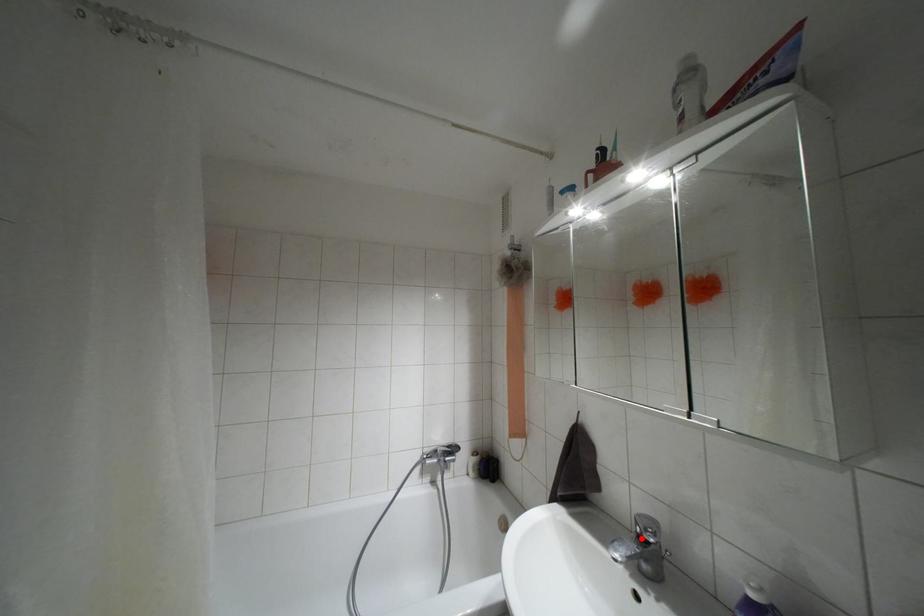
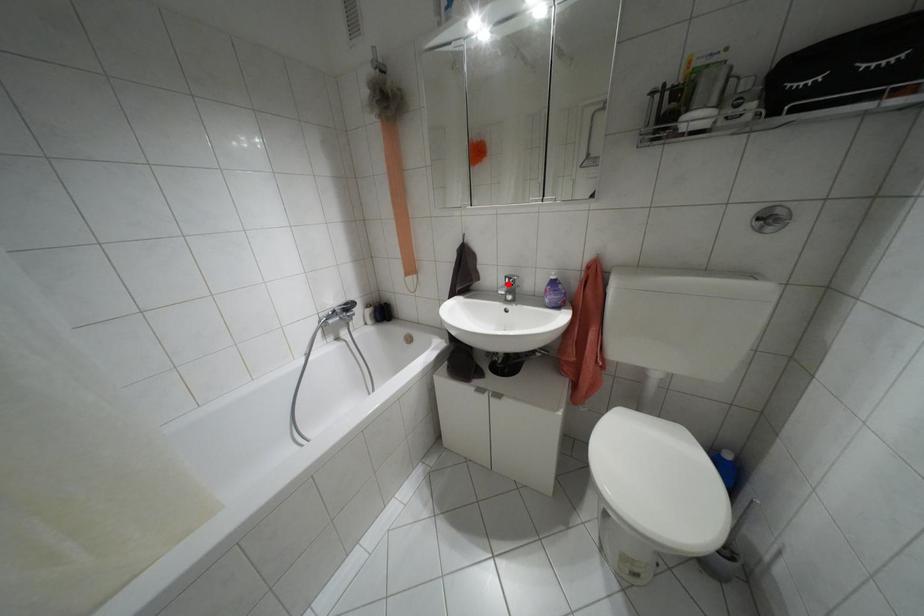
I am providing you with two images of the same scene from different viewpoints. A red point is marked on the first image and another point is marked on the second image. Are the points marked in image1 and image2 representing the same 3D position?

Yes